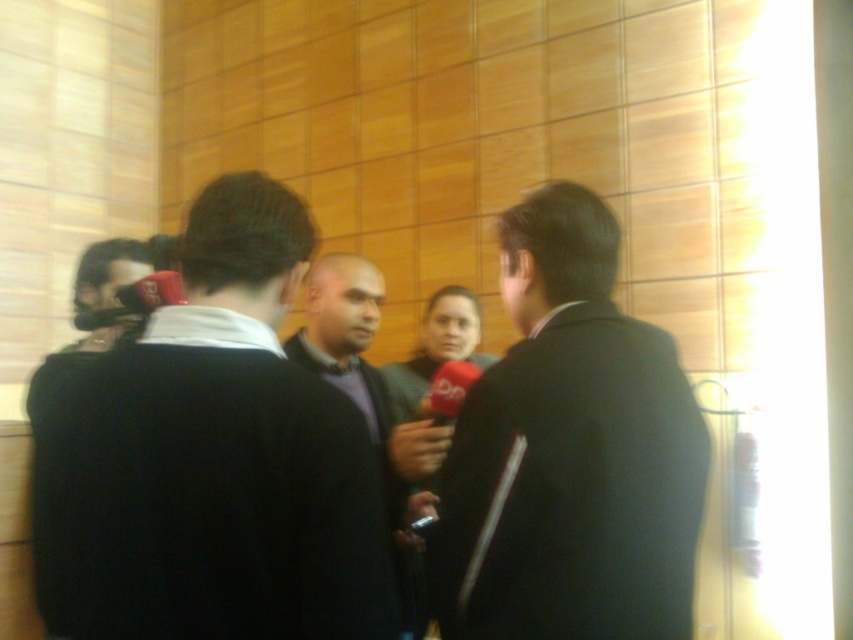
You are a photographer trying to set up a shot of the interview. You need to position your equipment so that the dark gray wool sweater at center and the matte black camera at left are both in frame. Based on their positions, which object should be placed closer to the left side of your camera frame?

The matte black camera at left should be placed closer to the left side of your camera frame since the dark gray wool sweater at center is to the right of it.

What are the coordinates of the dark gray sweater at center?

The dark gray sweater at center is located at coordinates point (212, 460).